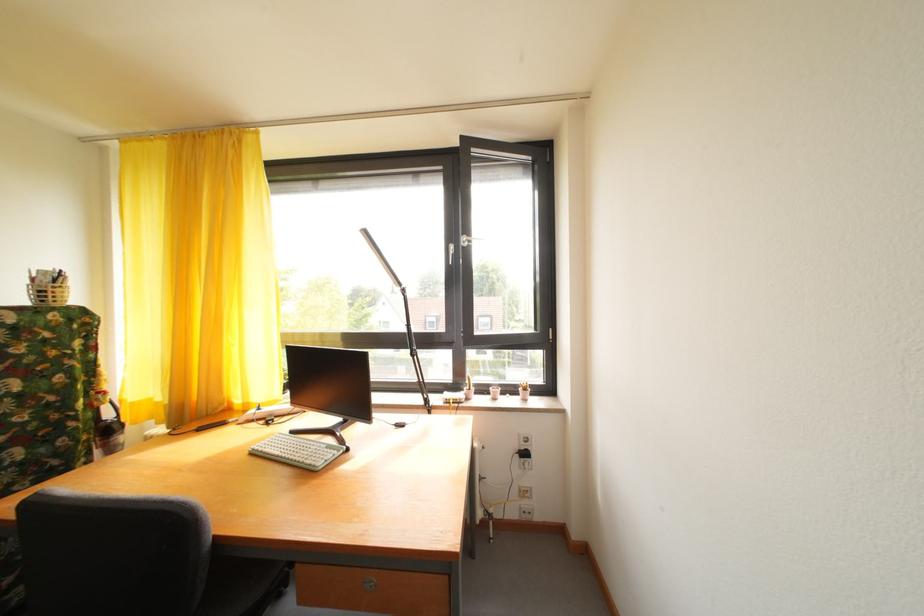
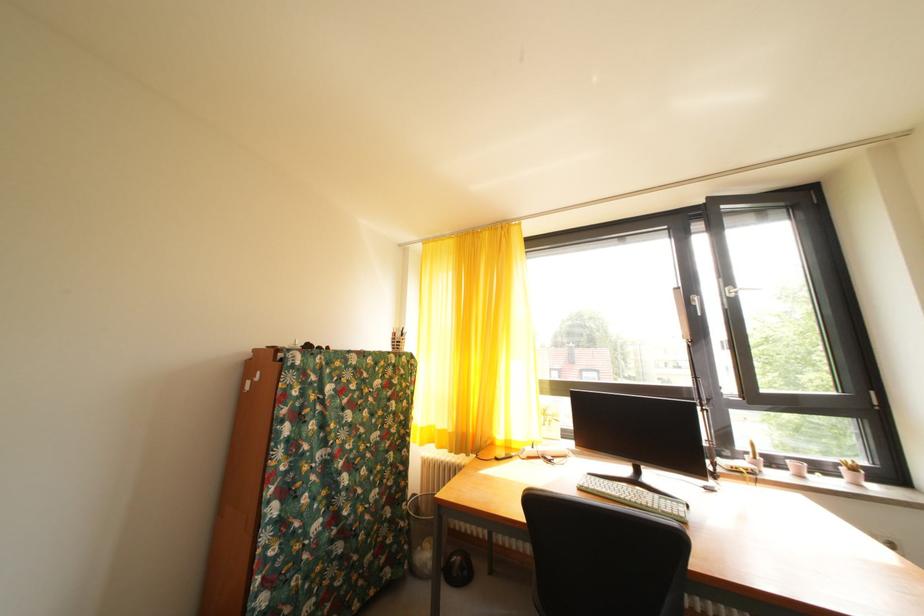
What movement of the cameraman would produce the second image?

The cameraman walked toward left, backward.